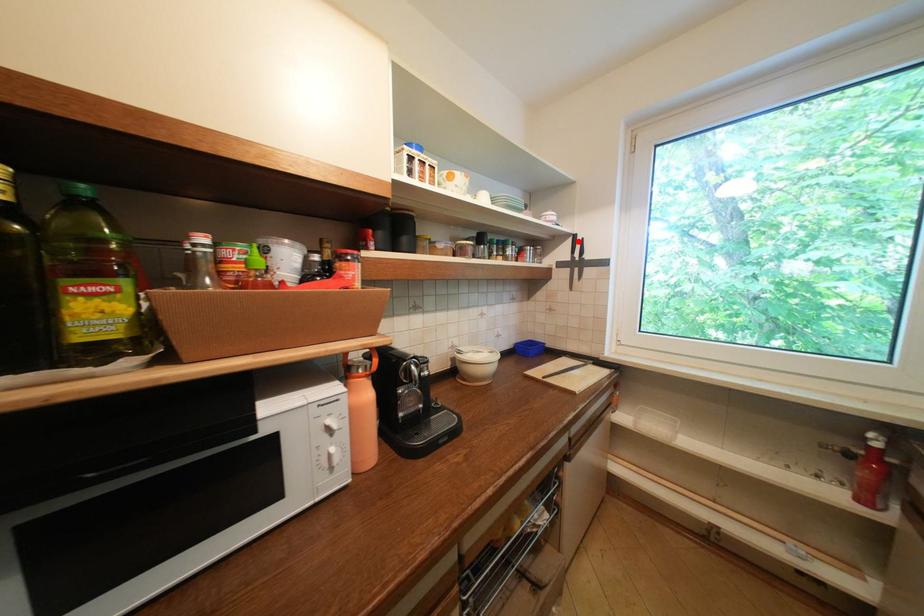
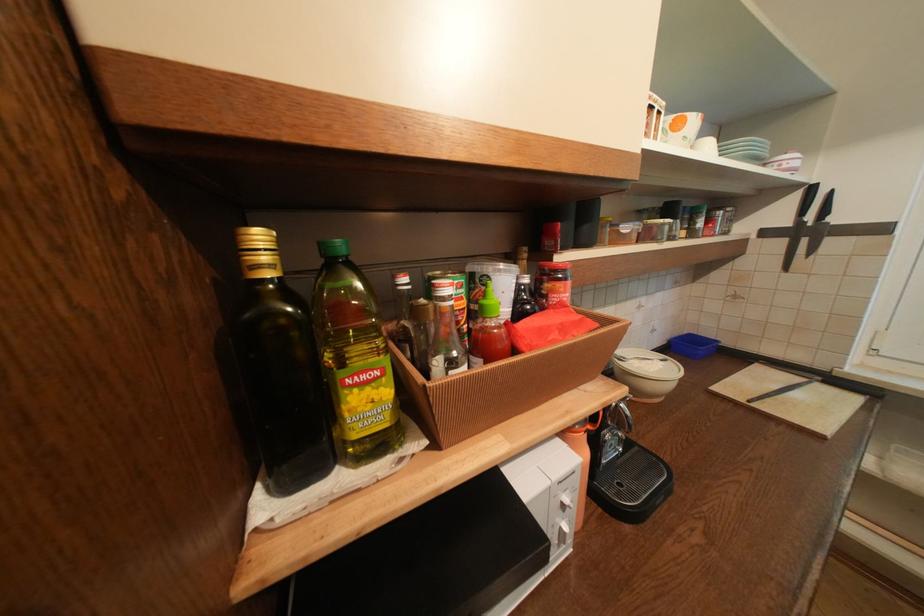
Locate, in the second image, the point that corresponds to the highlighted location in the first image.

(807, 196)